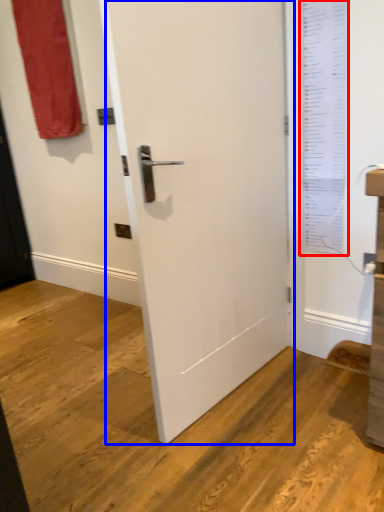
Question: Among these objects, which one is nearest to the camera, window screen (highlighted by a red box) or door (highlighted by a blue box)?

Choices:
 (A) window screen
 (B) door

Answer: (B)